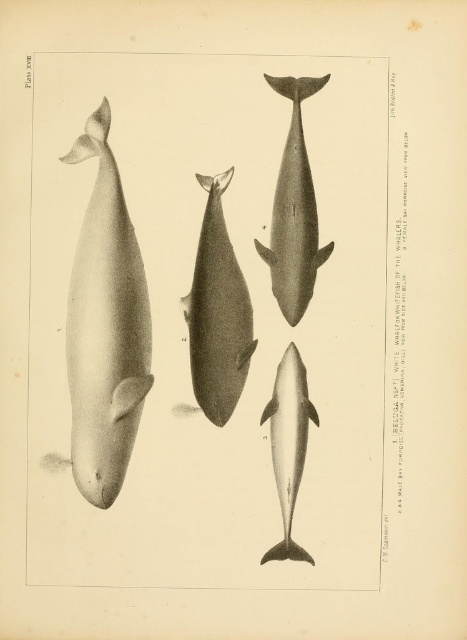
You are an art conservator working on a historical zoological illustration. You need to place a protective glass sheet over the image. The glass sheet has a 4.81 inches diameter circular opening. If you center the opening over the smooth gray whale at center, will the smooth gray dolphin at center also be visible through the opening?

The smooth gray whale at center and smooth gray dolphin at center are 4.81 inches apart from each other. Since the opening has a diameter of 4.81 inches, the distance between them equals the opening size. Therefore, the smooth gray dolphin at center will just barely be visible at the edge of the opening.

You are a marine biologist examining this illustration of whale species. You notice two smooth gray whales labeled in the image. The smooth gray whale at center and the smooth gray whale at upper center. Based on their sizes, which one would you estimate is the younger whale?

The smooth gray whale at center has a smaller size compared to the smooth gray whale at upper center, so the smooth gray whale at center is likely the younger whale since younger animals are typically smaller in size.